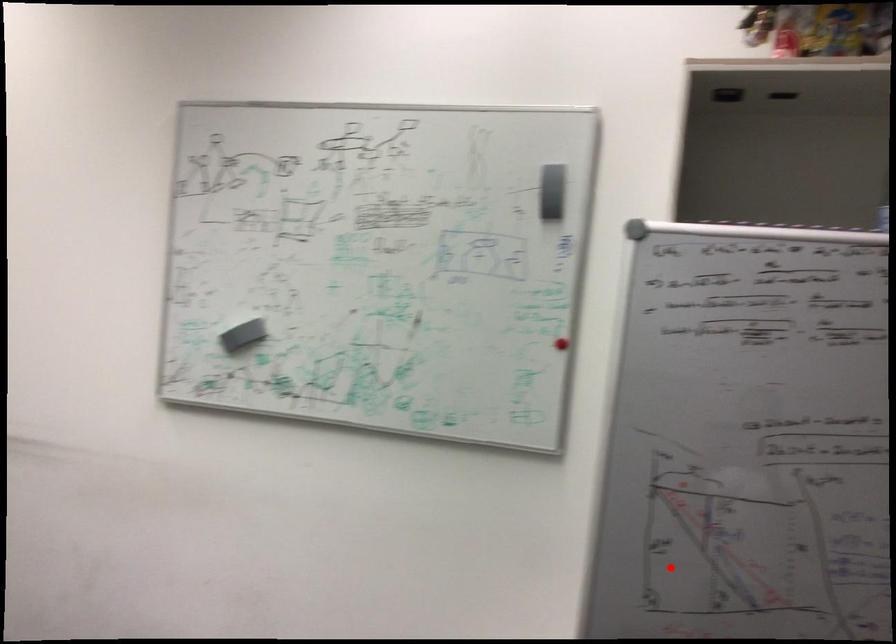
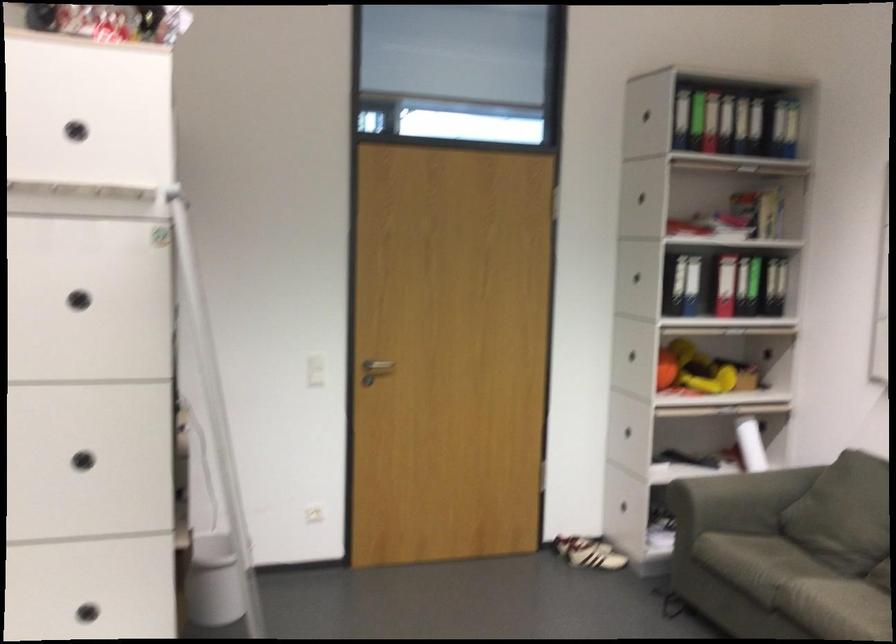
The point at the highlighted location is marked in the first image. Where is the corresponding point in the second image?

(83, 456)